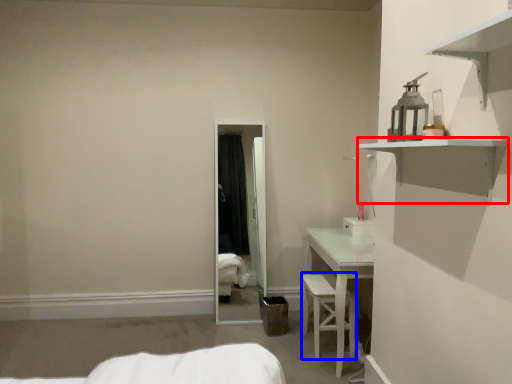
Question: Which of the following is the closest to the observer, shelf (highlighted by a red box) or armchair (highlighted by a blue box)?

Choices:
 (A) shelf
 (B) armchair

Answer: (A)